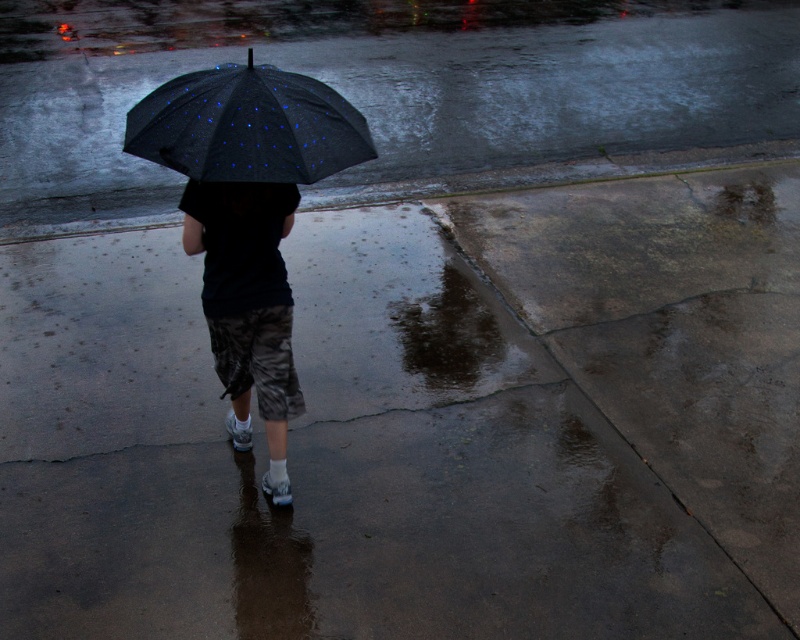
Question: Does black matte umbrella at center appear on the left side of glossy concrete puddle at lower center?

Choices:
 (A) no
 (B) yes

Answer: (B)

Question: Can you confirm if camouflage shorts at center is bigger than glossy concrete puddle at lower center?

Choices:
 (A) yes
 (B) no

Answer: (A)

Question: Which object is closer to the camera taking this photo?

Choices:
 (A) glossy concrete puddle at lower center
 (B) black matte umbrella at center
 (C) camouflage shorts at center

Answer: (B)

Question: Can you confirm if camouflage shorts at center is bigger than glossy concrete puddle at lower center?

Choices:
 (A) no
 (B) yes

Answer: (B)

Question: Which object appears closest to the camera in this image?

Choices:
 (A) black matte umbrella at center
 (B) camouflage shorts at center

Answer: (A)

Question: Which object is positioned farthest from the black matte umbrella at center?

Choices:
 (A) camouflage shorts at center
 (B) glossy concrete puddle at lower center

Answer: (B)